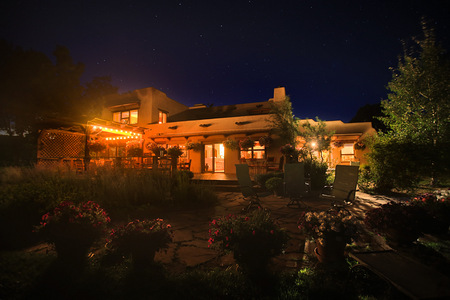
Image resolution: width=450 pixels, height=300 pixels. I want to click on light, so click(109, 129).